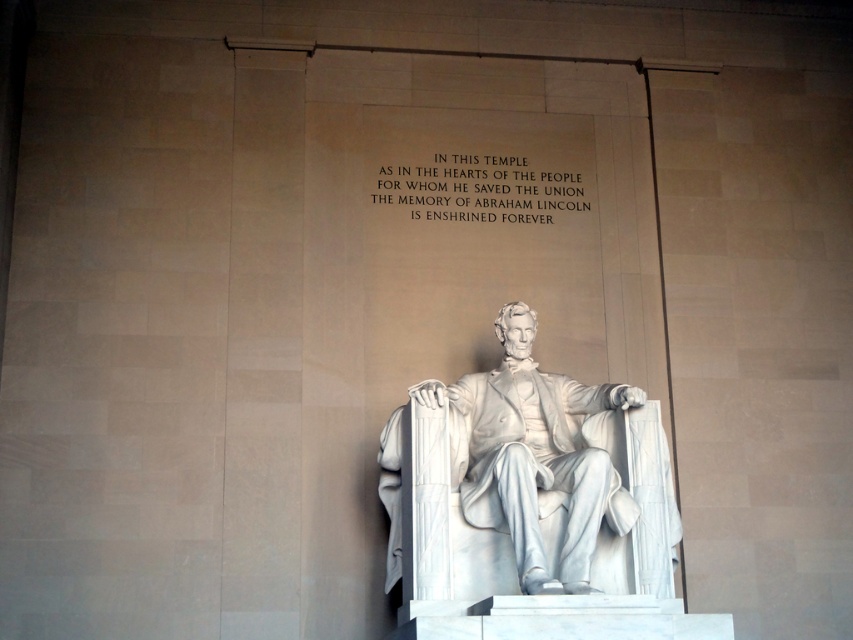
Which is more to the left, white marble statue at center or white stone text at upper center?

From the viewer's perspective, white stone text at upper center appears more on the left side.

Between point (405, 577) and point (445, 156), which one is positioned behind?

The point (445, 156) is more distant.

This screenshot has height=640, width=853. Find the location of `white marble statue at center`. white marble statue at center is located at coordinates (527, 483).